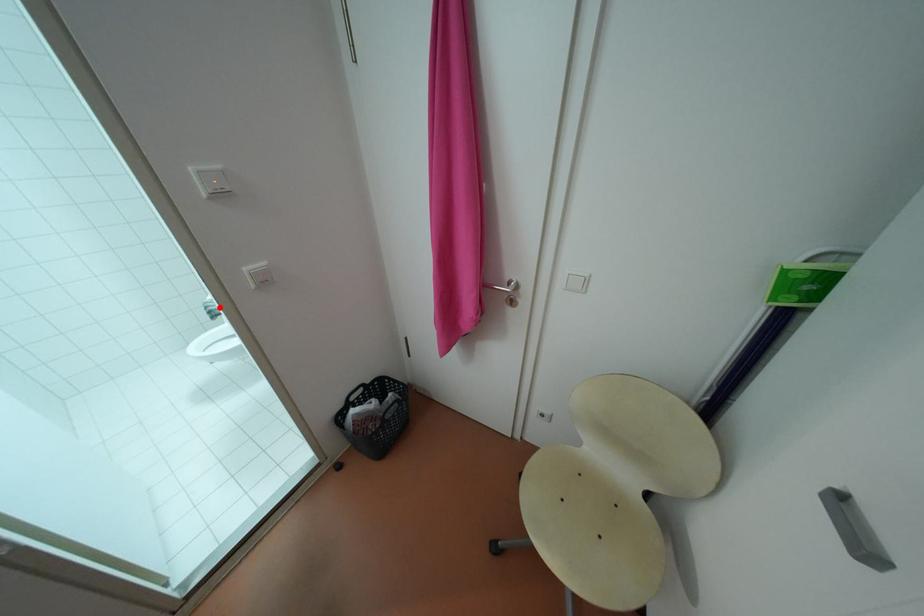
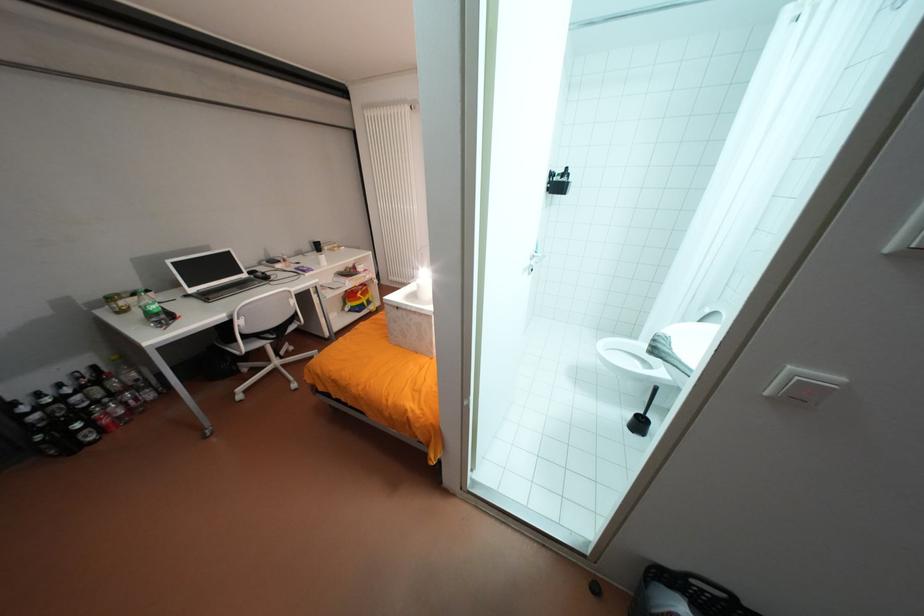
Question: I am providing you with two images of the same scene from different viewpoints. Image1 has a red point marked. In image2, the corresponding 3D location appears at what relative position? Reply with the corresponding letter.

Choices:
 (A) Closer
 (B) Farther

Answer: (A)